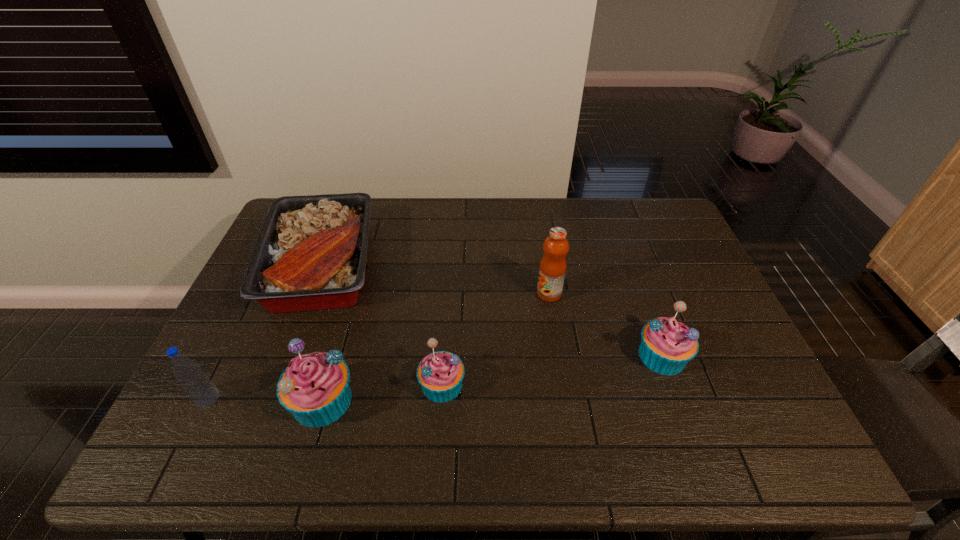
Locate an element on the screen. Image resolution: width=960 pixels, height=540 pixels. water bottle located in the left edge section of the desktop is located at coordinates (195, 382).

Identify the location of object that is at the right edge. The height and width of the screenshot is (540, 960). (667, 345).

At what (x,y) coordinates should I click in order to perform the action: click on object located at the far left corner. Please return your answer as a coordinate pair (x, y). This screenshot has height=540, width=960. Looking at the image, I should click on (310, 255).

Where is `object present at the near left corner`? The height and width of the screenshot is (540, 960). object present at the near left corner is located at coordinates (195, 382).

Find the location of a particular element. Image resolution: width=960 pixels, height=540 pixels. free space at the far edge of the desktop is located at coordinates (582, 206).

The width and height of the screenshot is (960, 540). In order to click on vacant space at the near edge in this screenshot , I will do `click(666, 390)`.

Identify the location of free point at the right edge. The image size is (960, 540). (727, 344).

Where is `vacant region at the far right corner of the desktop`? The height and width of the screenshot is (540, 960). vacant region at the far right corner of the desktop is located at coordinates 662,200.

In the image, there is a desktop. Find the location of `vacant space at the near right corner`. vacant space at the near right corner is located at coordinates (733, 415).

Identify the location of empty space between the leftmost muffin and the second shortest muffin. The image size is (960, 540). (492, 378).